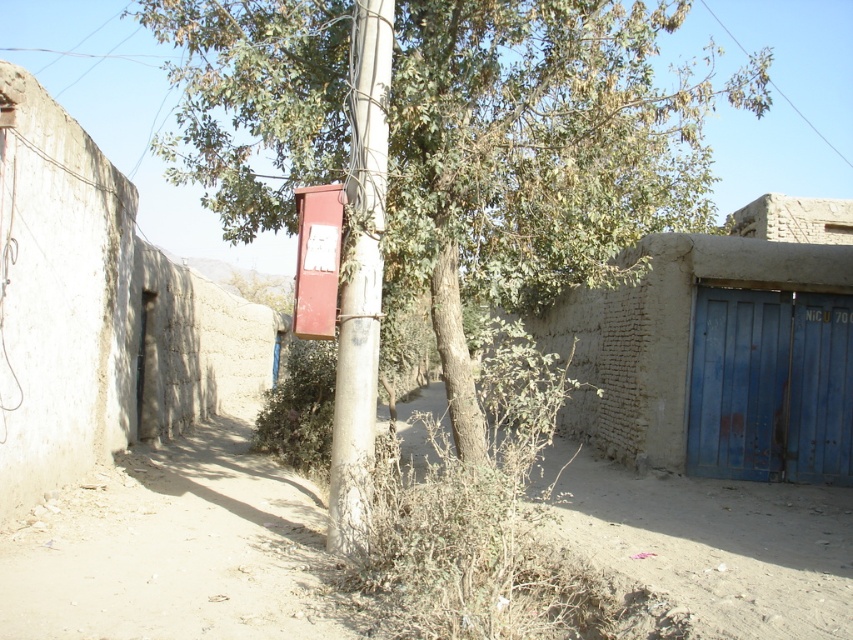
Locate an element on the screen. The height and width of the screenshot is (640, 853). green leafy tree at center is located at coordinates (537, 156).

Is green leafy tree at center thinner than matte red mailbox at center?

No.

This screenshot has width=853, height=640. Find the location of `green leafy tree at center`. green leafy tree at center is located at coordinates (537, 156).

Can you confirm if blue mud hut at right is positioned above metallic red phone box at center?

Actually, blue mud hut at right is below metallic red phone box at center.

Does blue mud hut at right have a larger size compared to metallic red phone box at center?

Indeed, blue mud hut at right has a larger size compared to metallic red phone box at center.

Is point (596, 410) positioned in front of point (325, 292)?

No, (596, 410) is further to viewer.

You are a GUI agent. You are given a task and a screenshot of the screen. Output one action in this format:
    pyautogui.click(x=<x>, y=<y>)
    Task: Click on the blue mud hut at right
    The image size is (853, 640).
    Given the screenshot: What is the action you would take?
    pyautogui.click(x=721, y=348)

Locate an element on the screen. This screenshot has height=640, width=853. concrete pole at center is located at coordinates (360, 275).

The width and height of the screenshot is (853, 640). In order to click on concrete pole at center in this screenshot , I will do `click(360, 275)`.

This screenshot has width=853, height=640. I want to click on concrete pole at center, so click(x=360, y=275).